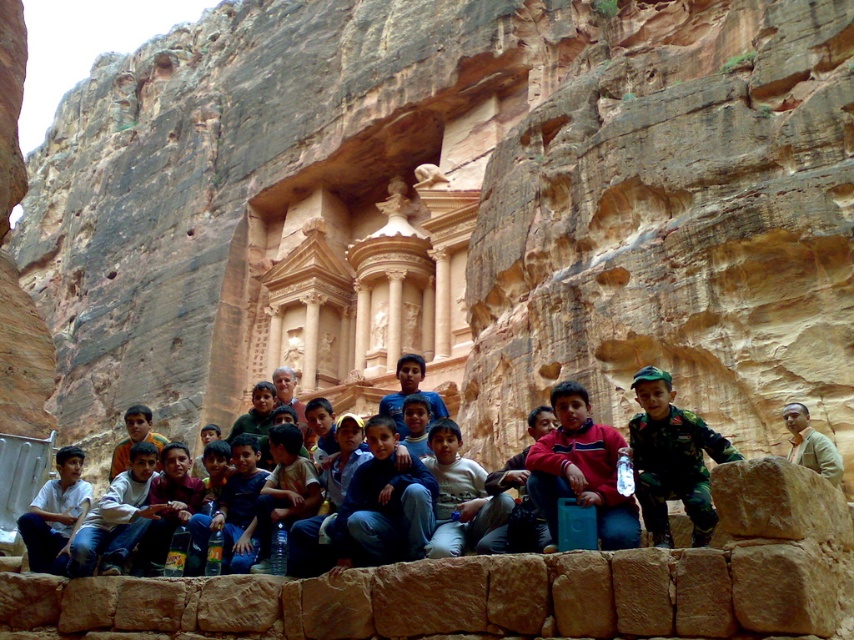
You are a photographer trying to capture a group photo. You notice two people in the group wearing a camouflage uniform at center and a red fleece jacket at center. If you want to ensure both subjects are in focus, what is the minimum distance you should set your camera lens to focus on?

The camouflage uniform at center is 2.53 meters away from red fleece jacket at center. To ensure both are in focus, the camera should be set to focus at a distance that accommodates the furthest subject, which would be either the camouflage uniform at center or the red fleece jacket at center depending on their exact positions. However, since both are at the same center position but 2.53 meters apart, the minimum focusing distance should be at least 2.53 meters to cover both.

You are a photographer trying to capture a group photo. You notice two people wearing a camouflage uniform at center and a light brown leather jacket at center. Which person should you ask to move closer to the camera to ensure both are in focus, considering their clothing width?

The camouflage uniform at center has a greater width than the light brown leather jacket at center. To ensure both are in focus, you should ask the person in the camouflage uniform at center to move closer to the camera since wider objects may require adjustment for proper focus.

You are a photographer trying to capture a group photo of the red fleece jacket at center and the light brown leather jacket at center. The camera you are using has a maximum focus range of 10 meters. Will you be able to focus on both jackets simultaneously?

The distance between the red fleece jacket at center and the light brown leather jacket at center is 12.16 meters. Since the camera can only focus up to 10 meters, it cannot capture both jackets in focus at the same time.